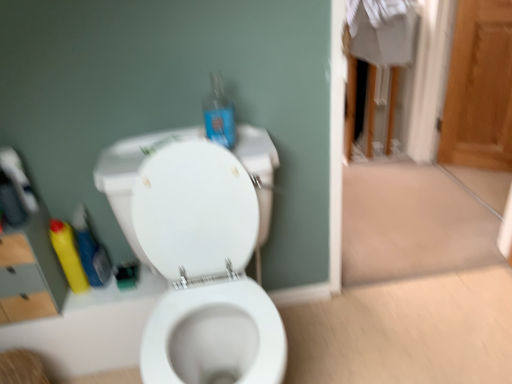
Consider the image. What is the approximate height of yellow matte bottle at lower left, which ranks as the first cleaning product in left-to-right order?

It is 11.24 inches.

You are a GUI agent. You are given a task and a screenshot of the screen. Output one action in this format:
    pyautogui.click(x=<x>, y=<y>)
    Task: Click on the yellow matte bottle at lower left, the 2th cleaning product positioned from the right
    
    Given the screenshot: What is the action you would take?
    68,255

Image resolution: width=512 pixels, height=384 pixels. I want to click on matte gray medicine cabinet at left, so click(x=26, y=249).

From a real-world perspective, is yellow matte bottle at lower left, which ranks as the first cleaning product in left-to-right order, physically above white glossy toilet at center?

Yes.

Looking at this image, how many degrees apart are the facing directions of yellow matte bottle at lower left, which ranks as the first cleaning product in left-to-right order, and white glossy toilet at center?

They differ by 0.0242 degrees in their facing directions.

Considering the relative sizes of yellow matte bottle at lower left, which ranks as the first cleaning product in left-to-right order, and white glossy toilet at center in the image provided, is yellow matte bottle at lower left, which ranks as the first cleaning product in left-to-right order, shorter than white glossy toilet at center?

Yes, yellow matte bottle at lower left, which ranks as the first cleaning product in left-to-right order, is shorter than white glossy toilet at center.

Measure the distance from white glossy toilet at center to yellow plastic bottle at left, the first cleaning product positioned from the right.

They are 16.69 inches apart.

From the picture: Could you tell me if white glossy toilet at center is turned towards yellow plastic bottle at left, which appears as the second cleaning product when viewed from the left?

No, white glossy toilet at center does not turn towards yellow plastic bottle at left, which appears as the second cleaning product when viewed from the left.

From the image's perspective, is white glossy toilet at center located above or below yellow plastic bottle at left, which appears as the second cleaning product when viewed from the left?

white glossy toilet at center is situated lower than yellow plastic bottle at left, which appears as the second cleaning product when viewed from the left, in the image.

Is white glossy toilet at center behind yellow plastic bottle at left, the first cleaning product positioned from the right?

No, white glossy toilet at center is in front of yellow plastic bottle at left, the first cleaning product positioned from the right.

From the image's perspective, between wooden door at right and matte gray medicine cabinet at left, which one is located above?

wooden door at right, from the image's perspective.

Does point (458, 99) come in front of point (39, 248)?

No, (458, 99) is further to viewer.

From a real-world perspective, is wooden door at right positioned over matte gray medicine cabinet at left based on gravity?

No, from a real-world perspective, wooden door at right is not over matte gray medicine cabinet at left

In the scene shown: Is wooden door at right oriented away from matte gray medicine cabinet at left?

wooden door at right is not turned away from matte gray medicine cabinet at left.

Could you measure the distance between yellow plastic bottle at left, which appears as the second cleaning product when viewed from the left, and translucent blue plastic bottle at upper center?

56.91 centimeters.

Which of these two, yellow plastic bottle at left, which appears as the second cleaning product when viewed from the left, or translucent blue plastic bottle at upper center, is wider?

Wider between the two is translucent blue plastic bottle at upper center.

Is the depth of yellow plastic bottle at left, the first cleaning product positioned from the right, less than that of translucent blue plastic bottle at upper center?

No.

From a real-world perspective, between yellow plastic bottle at left, which appears as the second cleaning product when viewed from the left, and translucent blue plastic bottle at upper center, who is vertically higher?

translucent blue plastic bottle at upper center, from a real-world perspective.

Which is more to the right, yellow plastic bottle at left, the first cleaning product positioned from the right, or white glossy toilet at center?

white glossy toilet at center is more to the right.

Is yellow plastic bottle at left, which appears as the second cleaning product when viewed from the left, not near white glossy toilet at center?

No, there isn't a large distance between yellow plastic bottle at left, which appears as the second cleaning product when viewed from the left, and white glossy toilet at center.

From a real-world perspective, which is physically below, yellow plastic bottle at left, which appears as the second cleaning product when viewed from the left, or white glossy toilet at center?

white glossy toilet at center, from a real-world perspective.

From the image's perspective, is yellow plastic bottle at left, the first cleaning product positioned from the right, below white glossy toilet at center?

No.

Does point (99, 244) lie in front of point (9, 150)?

That is False.

Does yellow plastic bottle at left, the first cleaning product positioned from the right, have a greater height compared to matte gray medicine cabinet at left?

Incorrect, the height of yellow plastic bottle at left, the first cleaning product positioned from the right, is not larger of that of matte gray medicine cabinet at left.

How distant is yellow plastic bottle at left, which appears as the second cleaning product when viewed from the left, from matte gray medicine cabinet at left?

Result: yellow plastic bottle at left, which appears as the second cleaning product when viewed from the left, is 6.25 inches away from matte gray medicine cabinet at left.

Can you confirm if yellow plastic bottle at left, the first cleaning product positioned from the right, is wider than matte gray medicine cabinet at left?

In fact, yellow plastic bottle at left, the first cleaning product positioned from the right, might be narrower than matte gray medicine cabinet at left.

Could you tell me if yellow matte bottle at lower left, the 2th cleaning product positioned from the right, is facing wooden door at right?

No, yellow matte bottle at lower left, the 2th cleaning product positioned from the right, is not turned towards wooden door at right.

Looking at this image, from the image's perspective, which is above, yellow matte bottle at lower left, which ranks as the first cleaning product in left-to-right order, or wooden door at right?

wooden door at right.

How distant is yellow matte bottle at lower left, the 2th cleaning product positioned from the right, from wooden door at right?

2.17 meters.

Would you say yellow matte bottle at lower left, which ranks as the first cleaning product in left-to-right order, is inside or outside wooden door at right?

yellow matte bottle at lower left, which ranks as the first cleaning product in left-to-right order, is not inside wooden door at right, it's outside.

At what (x,y) coordinates should I click in order to perform the action: click on toilet that appears on the right of yellow matte bottle at lower left, which ranks as the first cleaning product in left-to-right order. Please return your answer as a coordinate pair (x, y). Image resolution: width=512 pixels, height=384 pixels. Looking at the image, I should click on (197, 254).

From the white glossy toilet at center, count the 1st cleaning product to the left and point to it. Please provide its 2D coordinates.

[(90, 249)]

Based on their spatial positions, is yellow matte bottle at lower left, the 2th cleaning product positioned from the right, or translucent blue plastic bottle at upper center further from matte gray medicine cabinet at left?

The object further to matte gray medicine cabinet at left is translucent blue plastic bottle at upper center.

When comparing their distances from wooden door at right, does yellow matte bottle at lower left, the 2th cleaning product positioned from the right, or yellow plastic bottle at left, the first cleaning product positioned from the right, seem closer?

yellow plastic bottle at left, the first cleaning product positioned from the right, is positioned closer to the anchor wooden door at right.

Looking at the image, which one is located further to white glossy toilet at center, wooden door at right or matte gray medicine cabinet at left?

wooden door at right is positioned further to the anchor white glossy toilet at center.

Which object lies nearer to the anchor point translucent blue plastic bottle at upper center, white glossy toilet at center or matte gray medicine cabinet at left?

white glossy toilet at center lies closer to translucent blue plastic bottle at upper center than the other object.

Looking at the image, which one is located closer to yellow matte bottle at lower left, which ranks as the first cleaning product in left-to-right order, translucent blue plastic bottle at upper center or wooden door at right?

Based on the image, translucent blue plastic bottle at upper center appears to be nearer to yellow matte bottle at lower left, which ranks as the first cleaning product in left-to-right order.

When comparing their distances from yellow plastic bottle at left, which appears as the second cleaning product when viewed from the left, does yellow matte bottle at lower left, which ranks as the first cleaning product in left-to-right order, or translucent blue plastic bottle at upper center seem closer?

Based on the image, yellow matte bottle at lower left, which ranks as the first cleaning product in left-to-right order, appears to be nearer to yellow plastic bottle at left, which appears as the second cleaning product when viewed from the left.

Which object lies further to the anchor point white glossy toilet at center, translucent blue plastic bottle at upper center or yellow plastic bottle at left, the first cleaning product positioned from the right?

yellow plastic bottle at left, the first cleaning product positioned from the right, is positioned further to the anchor white glossy toilet at center.

Based on their spatial positions, is translucent blue plastic bottle at upper center or yellow plastic bottle at left, the first cleaning product positioned from the right, further from yellow matte bottle at lower left, which ranks as the first cleaning product in left-to-right order?

translucent blue plastic bottle at upper center is further to yellow matte bottle at lower left, which ranks as the first cleaning product in left-to-right order.

The image size is (512, 384). I want to click on cleaning product between matte gray medicine cabinet at left and yellow plastic bottle at left, which appears as the second cleaning product when viewed from the left, so click(x=68, y=255).

Locate an element on the screen. The width and height of the screenshot is (512, 384). cleaning product between white glossy toilet at center and yellow plastic bottle at left, which appears as the second cleaning product when viewed from the left, along the z-axis is located at coordinates (68, 255).

This screenshot has height=384, width=512. In order to click on bottle between white glossy toilet at center and yellow plastic bottle at left, which appears as the second cleaning product when viewed from the left, in the front-back direction in this screenshot , I will do `click(219, 114)`.

Identify the location of toilet situated between yellow plastic bottle at left, the first cleaning product positioned from the right, and wooden door at right from left to right. (197, 254).